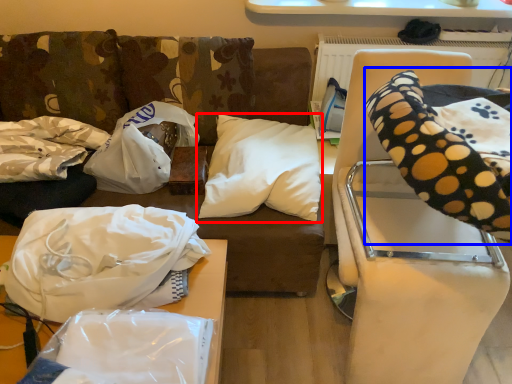
Question: Which of the following is the closest to the observer, pillow (highlighted by a red box) or bean bag chair (highlighted by a blue box)?

Choices:
 (A) pillow
 (B) bean bag chair

Answer: (B)